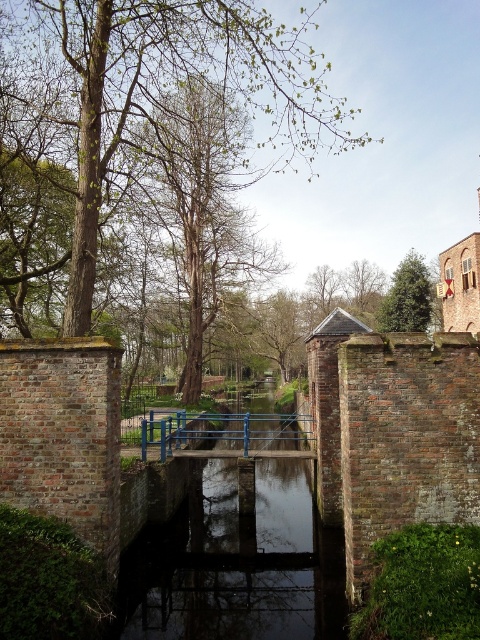
Question: Which point appears closest to the camera in this image?

Choices:
 (A) (196, 150)
 (B) (428, 323)
 (C) (109, 120)

Answer: (C)

Question: Which object appears closest to the camera in this image?

Choices:
 (A) green leafy tree at upper left
 (B) green textured tree at upper right

Answer: (A)

Question: Is green leafy tree at upper left wider than green textured tree at upper right?

Choices:
 (A) yes
 (B) no

Answer: (A)

Question: Can you confirm if brown wood tree at center is positioned to the right of green leafy tree at upper center?

Choices:
 (A) yes
 (B) no

Answer: (B)

Question: Among these objects, which one is farthest from the camera?

Choices:
 (A) green textured tree at upper right
 (B) brown wood tree at center

Answer: (A)

Question: Observing the image, what is the correct spatial positioning of green textured tree at upper right in reference to green leafy tree at upper center?

Choices:
 (A) right
 (B) left

Answer: (A)